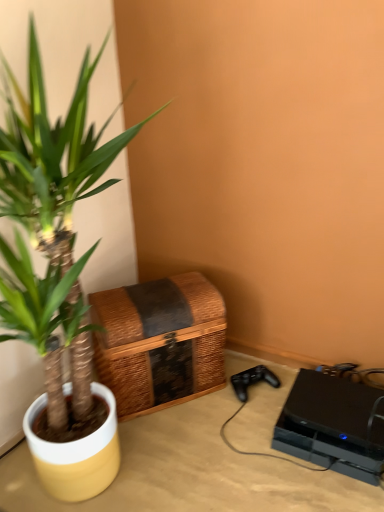
Where is `free space between green leafy plant at left and black matte gaming console at lower right`? This screenshot has height=512, width=384. free space between green leafy plant at left and black matte gaming console at lower right is located at coordinates (248, 460).